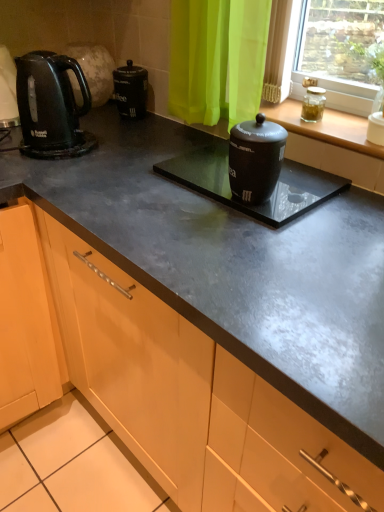
Image resolution: width=384 pixels, height=512 pixels. What are the coordinates of `free space in front of matte black kettle at left` in the screenshot? It's located at (41, 167).